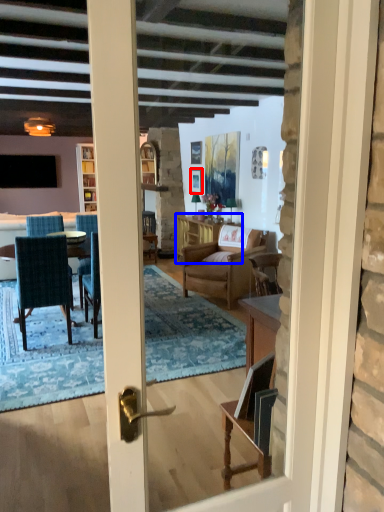
Question: Which object appears farthest to the camera in this image, picture frame (highlighted by a red box) or table (highlighted by a blue box)?

Choices:
 (A) picture frame
 (B) table

Answer: (A)